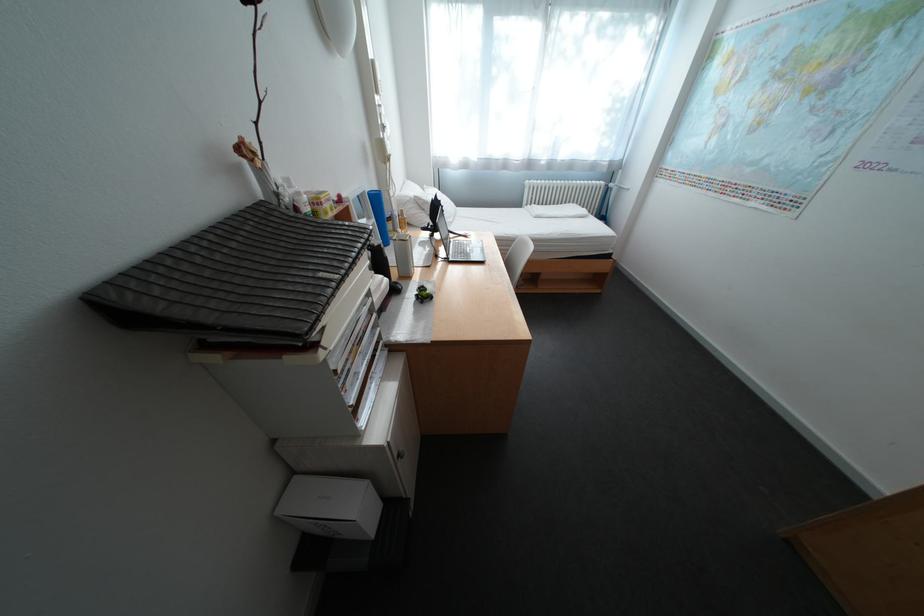
Describe the element at coordinates (300, 201) in the screenshot. I see `the grey thermos bottle` at that location.